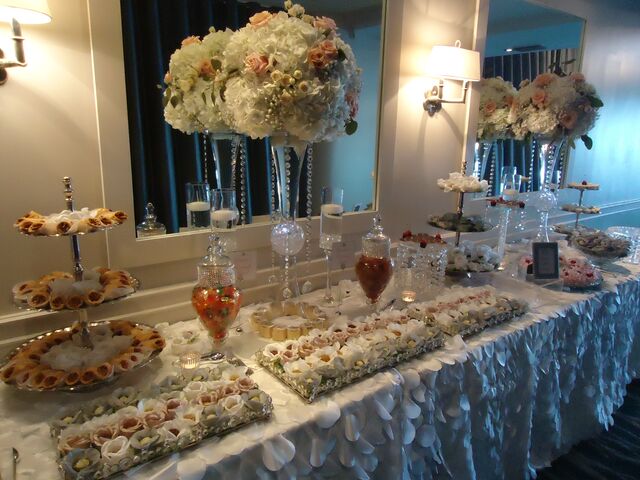
The width and height of the screenshot is (640, 480). I want to click on white wall behind table, so click(67, 136).